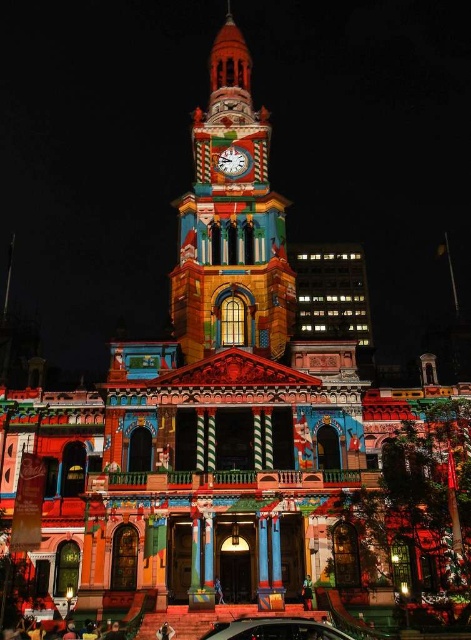
Question: Which point is farther to the camera?

Choices:
 (A) metallic silver car at lower center
 (B) multicolored mosaic clock tower at center
 (C) metallic silver clock at center

Answer: (C)

Question: Is multicolored mosaic clock tower at center behind metallic silver clock at center?

Choices:
 (A) yes
 (B) no

Answer: (B)

Question: Which object is closer to the camera taking this photo?

Choices:
 (A) metallic silver car at lower center
 (B) metallic silver clock at center

Answer: (A)

Question: Which object appears closest to the camera in this image?

Choices:
 (A) multicolored mosaic clock tower at center
 (B) metallic silver car at lower center

Answer: (B)

Question: Can you confirm if multicolored mosaic clock tower at center is positioned to the left of metallic silver clock at center?

Choices:
 (A) no
 (B) yes

Answer: (B)

Question: Is metallic silver car at lower center to the right of metallic silver clock at center from the viewer's perspective?

Choices:
 (A) no
 (B) yes

Answer: (B)